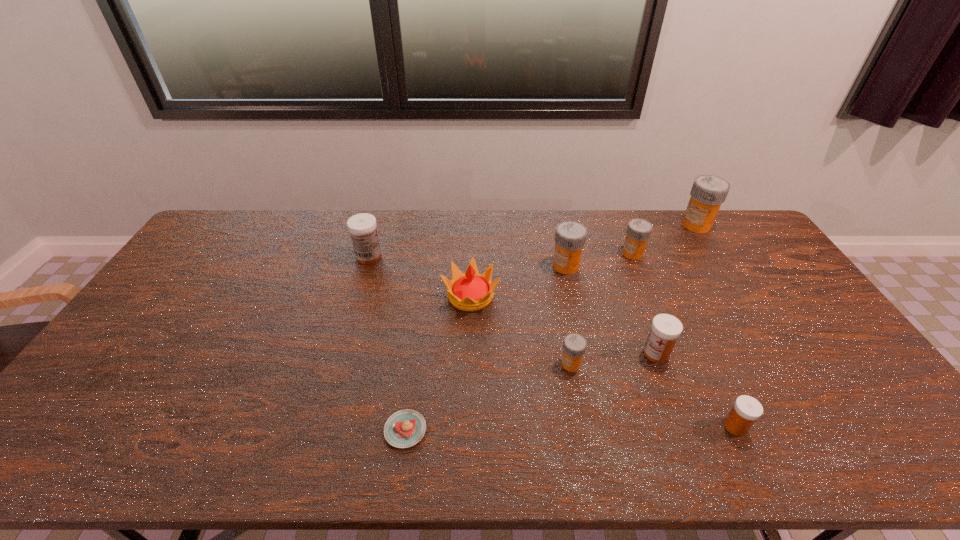
Where is `blank space located on the label side of the third smallest orange medicine`? blank space located on the label side of the third smallest orange medicine is located at coordinates (478, 266).

Locate an element on the screen. The width and height of the screenshot is (960, 540). free location located on the front of the biggest white medicine is located at coordinates (356, 299).

Identify the location of free space located 0.170m on the front of the third object from left to right. This screenshot has height=540, width=960. (469, 363).

Where is `vacant region located on the label side of the second smallest orange medicine`? vacant region located on the label side of the second smallest orange medicine is located at coordinates (601, 253).

You are a GUI agent. You are given a task and a screenshot of the screen. Output one action in this format:
    pyautogui.click(x=<x>, y=<y>)
    Task: Click on the free space located 0.130m on the label side of the second smallest orange medicine
    
    Given the screenshot: What is the action you would take?
    pyautogui.click(x=585, y=253)

You are a GUI agent. You are given a task and a screenshot of the screen. Output one action in this format:
    pyautogui.click(x=<x>, y=<y>)
    Task: Click on the free space located 0.120m on the label side of the second smallest orange medicine
    
    Given the screenshot: What is the action you would take?
    pyautogui.click(x=588, y=253)

At what (x,y) coordinates should I click in order to perform the action: click on free space located on the back of the second nearest white medicine. Please return your answer as a coordinate pair (x, y). Image resolution: width=960 pixels, height=540 pixels. Looking at the image, I should click on 628,277.

Find the location of `free space located on the left of the eighth object from left to right`. free space located on the left of the eighth object from left to right is located at coordinates (627, 427).

Find the location of a particular element. This screenshot has width=960, height=540. vacant area situated 0.140m on the label side of the nearest orange medicine is located at coordinates (509, 363).

The width and height of the screenshot is (960, 540). In order to click on vacant space situated on the label side of the nearest orange medicine in this screenshot , I will do `click(519, 363)`.